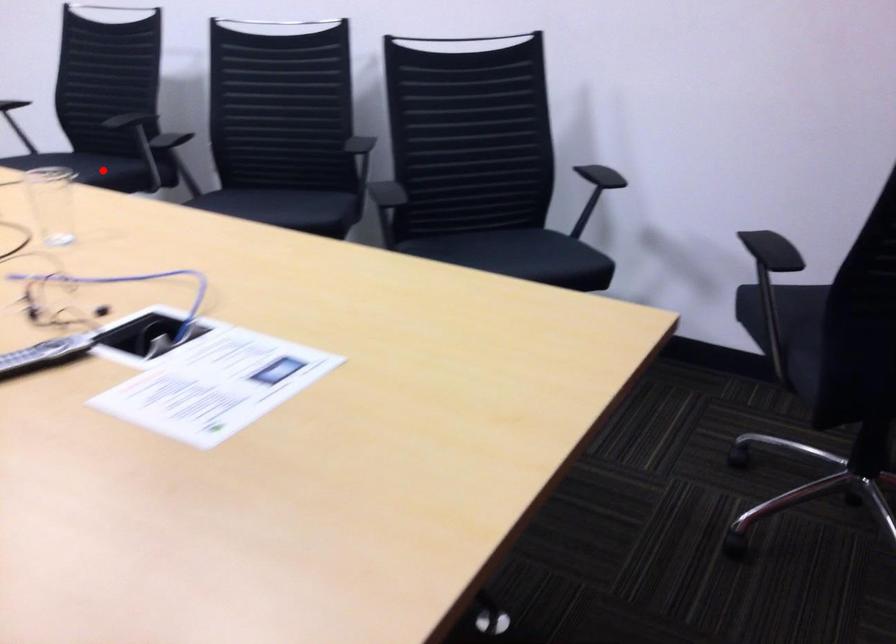
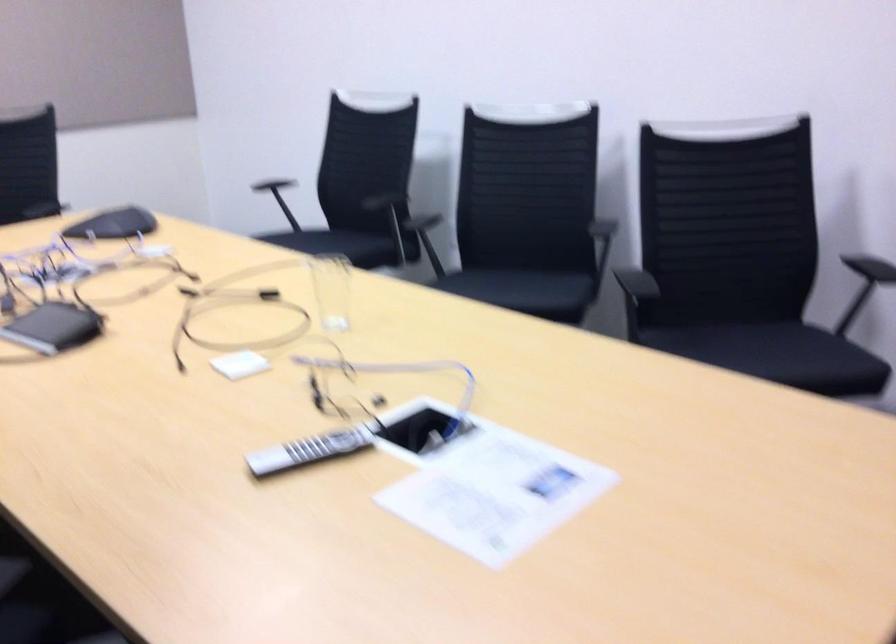
Find the pixel in the second image that matches the highlighted location in the first image.

(350, 245)